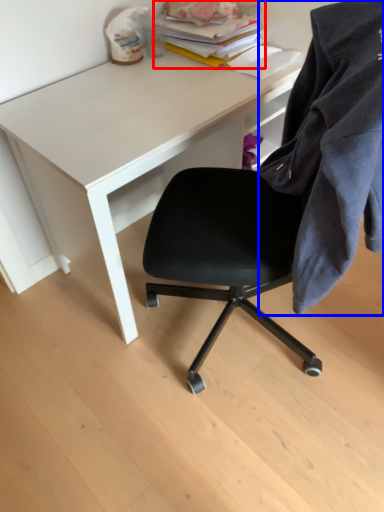
Question: Which point is closer to the camera, book (highlighted by a red box) or cloth (highlighted by a blue box)?

Choices:
 (A) book
 (B) cloth

Answer: (B)